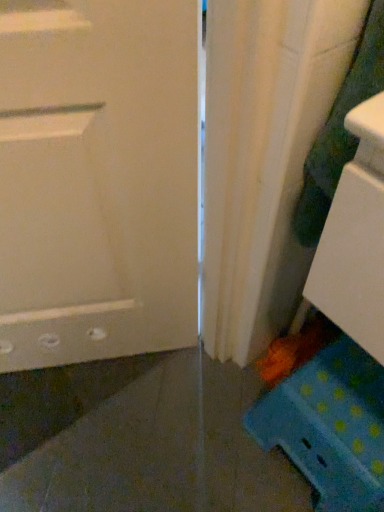
The width and height of the screenshot is (384, 512). What do you see at coordinates (339, 130) in the screenshot?
I see `green textured fabric at right` at bounding box center [339, 130].

In order to face green textured fabric at right, should I rotate leftwards or rightwards?

Rotate right and turn 21.200 degrees.

Locate an element on the screen. The width and height of the screenshot is (384, 512). green textured fabric at right is located at coordinates (339, 130).

The image size is (384, 512). What are the coordinates of `blue polka dot stool at lower right` in the screenshot? It's located at (330, 426).

This screenshot has width=384, height=512. What do you see at coordinates (330, 426) in the screenshot?
I see `blue polka dot stool at lower right` at bounding box center [330, 426].

Identify the location of green textured fabric at right. (339, 130).

Would you say blue polka dot stool at lower right is to the left or to the right of green textured fabric at right in the picture?

From the image, it's evident that blue polka dot stool at lower right is to the right of green textured fabric at right.

Consider the image. Between blue polka dot stool at lower right and green textured fabric at right, which one is positioned in front?

green textured fabric at right is more forward.

Is point (349, 410) farther from viewer compared to point (371, 77)?

Yes, it is behind point (371, 77).

From the image's perspective, is blue polka dot stool at lower right above or below green textured fabric at right?

From the image's perspective, blue polka dot stool at lower right appears below green textured fabric at right.

From a real-world perspective, relative to green textured fabric at right, is blue polka dot stool at lower right vertically above or below?

blue polka dot stool at lower right is situated lower than green textured fabric at right in the real world.

Considering the relative sizes of blue polka dot stool at lower right and green textured fabric at right in the image provided, is blue polka dot stool at lower right thinner than green textured fabric at right?

In fact, blue polka dot stool at lower right might be wider than green textured fabric at right.

Who is shorter, blue polka dot stool at lower right or green textured fabric at right?

With less height is blue polka dot stool at lower right.

Considering the relative sizes of blue polka dot stool at lower right and green textured fabric at right in the image provided, is blue polka dot stool at lower right bigger than green textured fabric at right?

Indeed, blue polka dot stool at lower right has a larger size compared to green textured fabric at right.

Is green textured fabric at right surrounded by blue polka dot stool at lower right?

No, green textured fabric at right is not a part of blue polka dot stool at lower right.

Is the surface of blue polka dot stool at lower right in direct contact with green textured fabric at right?

blue polka dot stool at lower right and green textured fabric at right are not in contact.

Is blue polka dot stool at lower right aimed at green textured fabric at right?

No, blue polka dot stool at lower right is not aimed at green textured fabric at right.

How different are the orientations of blue polka dot stool at lower right and green textured fabric at right in degrees?

The angular difference between blue polka dot stool at lower right and green textured fabric at right is 90 degrees.

The height and width of the screenshot is (512, 384). In order to click on laundry in front of the blue polka dot stool at lower right in this screenshot , I will do `click(339, 130)`.

Which is more to the left, green textured fabric at right or blue polka dot stool at lower right?

green textured fabric at right.

Which object is further away from the camera taking this photo, green textured fabric at right or blue polka dot stool at lower right?

blue polka dot stool at lower right is further from the camera.

Which is nearer, [323,135] or [320,496]?

Point [323,135] is positioned closer to the camera compared to point [320,496].

From the image's perspective, relative to blue polka dot stool at lower right, is green textured fabric at right above or below?

From the image's perspective, green textured fabric at right appears above blue polka dot stool at lower right.

From a real-world perspective, which object rests below the other?

From a 3D spatial view, blue polka dot stool at lower right is below.

Based on the photo, looking at their sizes, would you say green textured fabric at right is wider or thinner than blue polka dot stool at lower right?

green textured fabric at right is thinner than blue polka dot stool at lower right.

Can you confirm if green textured fabric at right is taller than blue polka dot stool at lower right?

Indeed, green textured fabric at right has a greater height compared to blue polka dot stool at lower right.

Between green textured fabric at right and blue polka dot stool at lower right, which one has smaller size?

Smaller between the two is green textured fabric at right.

Is green textured fabric at right not within blue polka dot stool at lower right?

green textured fabric at right is positioned outside blue polka dot stool at lower right.

Is green textured fabric at right far from blue polka dot stool at lower right?

Actually, green textured fabric at right and blue polka dot stool at lower right are a little close together.

Is green textured fabric at right oriented towards blue polka dot stool at lower right?

No, green textured fabric at right does not turn towards blue polka dot stool at lower right.

How different are the orientations of green textured fabric at right and blue polka dot stool at lower right in degrees?

The angle between the facing direction of green textured fabric at right and the facing direction of blue polka dot stool at lower right is 90 degrees.

Locate an element on the screen. The height and width of the screenshot is (512, 384). laundry lying in front of the blue polka dot stool at lower right is located at coordinates (339, 130).

In order to click on laundry on the left side of blue polka dot stool at lower right in this screenshot , I will do `click(339, 130)`.

This screenshot has width=384, height=512. Identify the location of cabinetry on the right of green textured fabric at right. (330, 426).